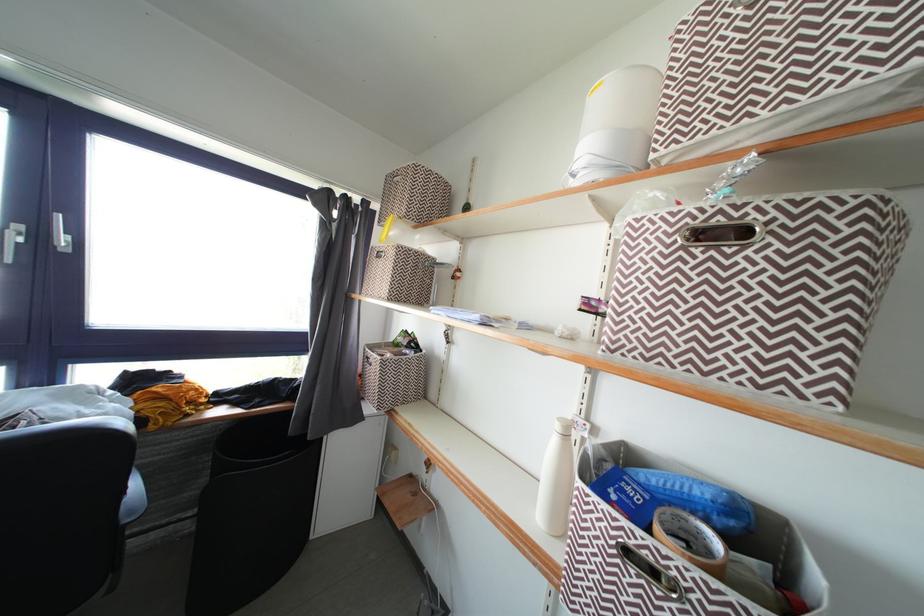
Locate an element on the screen. black waste basket is located at coordinates coord(250,514).